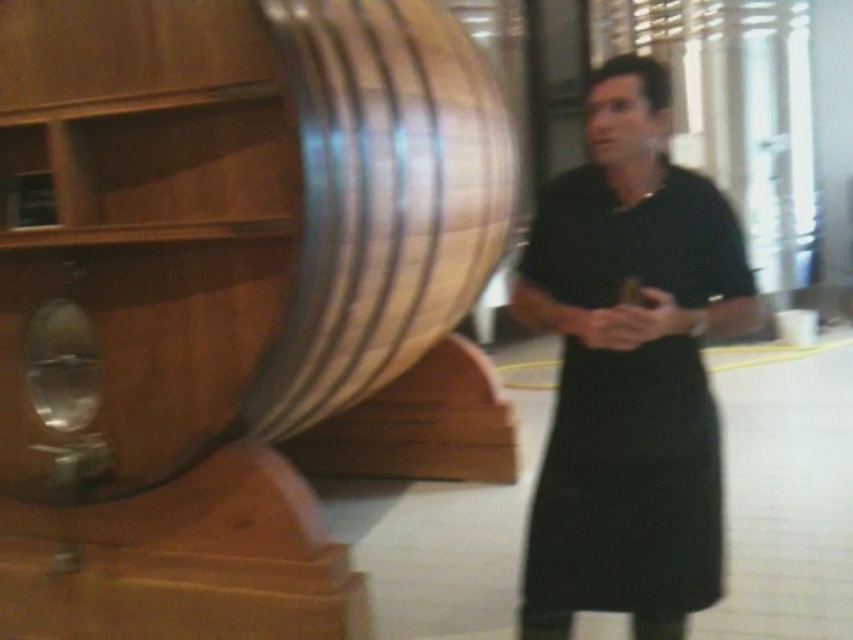
You are a visitor at the winery and see the wooden barrel at center and the black matte apron at center. Which object is positioned higher in the image?

The wooden barrel at center is above the black matte apron at center, so the wooden barrel at center is positioned higher in the image.

You are a visitor at the winery and want to take a photo of the wooden barrel at center without the black matte apron at center appearing in the frame. Which direction should you move to achieve this?

The wooden barrel at center is to the left of the black matte apron at center. To avoid the apron in your photo, move to the right side of the wooden barrel at center so that the apron is out of frame.

You are standing in a winery and see a point marked at coordinates (96, 490). If you want to place a wine barrel that is 4 feet in diameter at this point, will it fit without overlapping any existing barrels or objects around it?

The point at (96, 490) is 7.50 feet away from the viewer. Since the wine barrel has a diameter of 4 feet, it requires a space of at least 4 feet in width and depth. However, without specific information about the surrounding barrels or objects at that point, it is impossible to determine if there is enough space for the barrel to fit without overlapping.